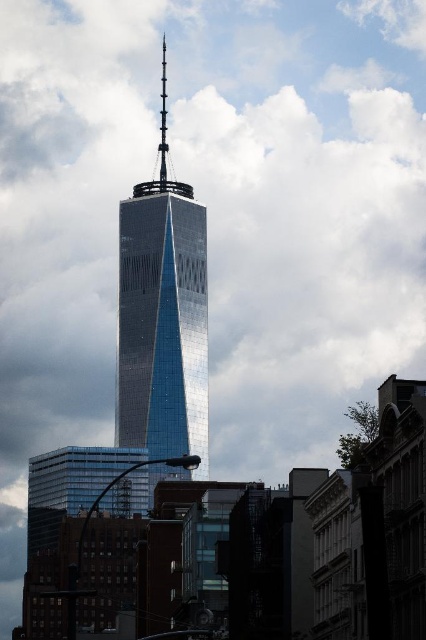
Consider the image. You are standing in front of the Freedom Tower and notice two points marked in the scene. The first point is at coordinates point [164,122] and the second is at point [166,77]. Which point is nearer to you?

Point [164,122] is closer to the viewer than point [166,77].

You are a photographer standing on the street in front of the shiny glass skyscraper at center and the polished steel spire at center. You want to take a photo that includes both objects in the frame. Since you can only focus on one object at a time, which object should you focus on to ensure the other remains in the background?

You should focus on the shiny glass skyscraper at center because it is closer to the viewer than the polished steel spire at center. By focusing on the closer object, the spire will naturally be in the background.